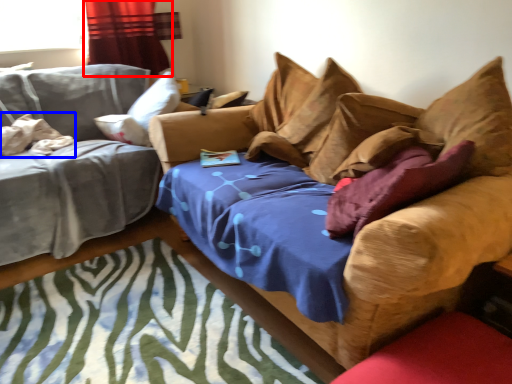
Question: Which point is closer to the camera, curtain (highlighted by a red box) or pillow (highlighted by a blue box)?

Choices:
 (A) curtain
 (B) pillow

Answer: (B)